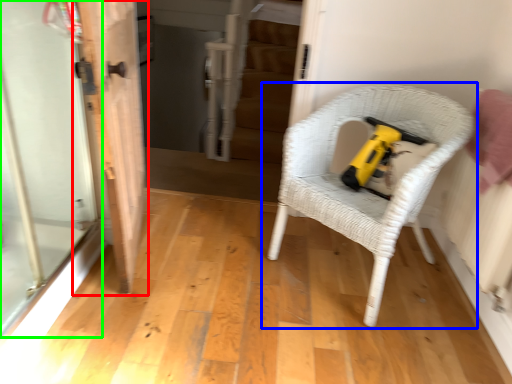
Question: Which object is positioned farthest from door (highlighted by a red box)? Select from chair (highlighted by a blue box) and screen door (highlighted by a green box).

Choices:
 (A) chair
 (B) screen door

Answer: (A)